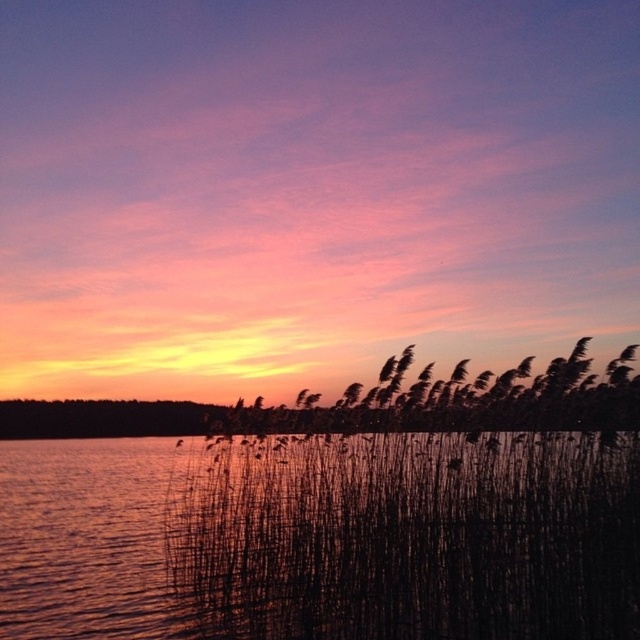
Question: Which point appears closest to the camera in this image?

Choices:
 (A) click(134, 301)
 (B) click(316, 502)

Answer: (B)

Question: Does silky reeds at center appear on the right side of black reed at center?

Choices:
 (A) yes
 (B) no

Answer: (A)

Question: Does silky reeds at center appear on the right side of black reed at center?

Choices:
 (A) no
 (B) yes

Answer: (B)

Question: Is the position of silky reeds at center more distant than that of black reed at center?

Choices:
 (A) yes
 (B) no

Answer: (A)

Question: Which point is farther to the camera?

Choices:
 (A) silky reeds at center
 (B) black reed at center

Answer: (A)